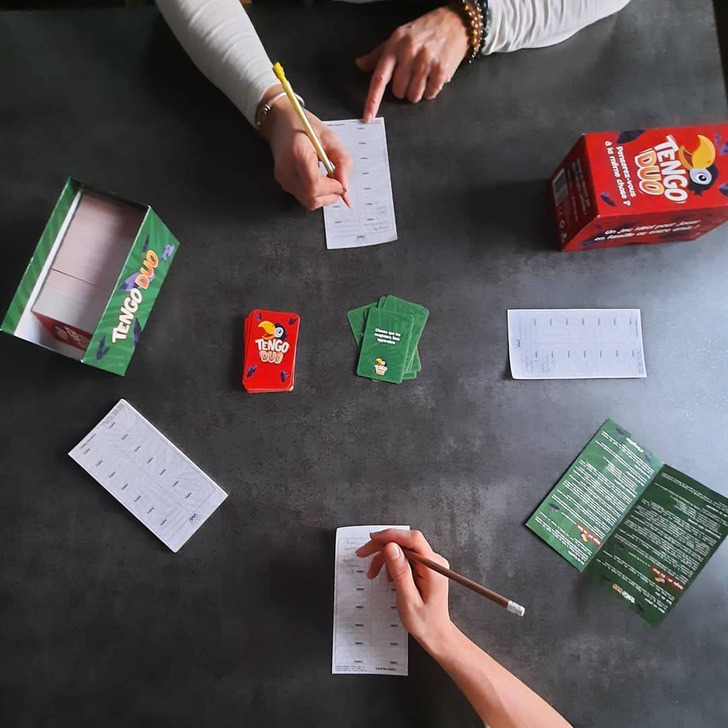
This screenshot has width=728, height=728. I want to click on red box lid for a game of playing cards, so click(624, 205).